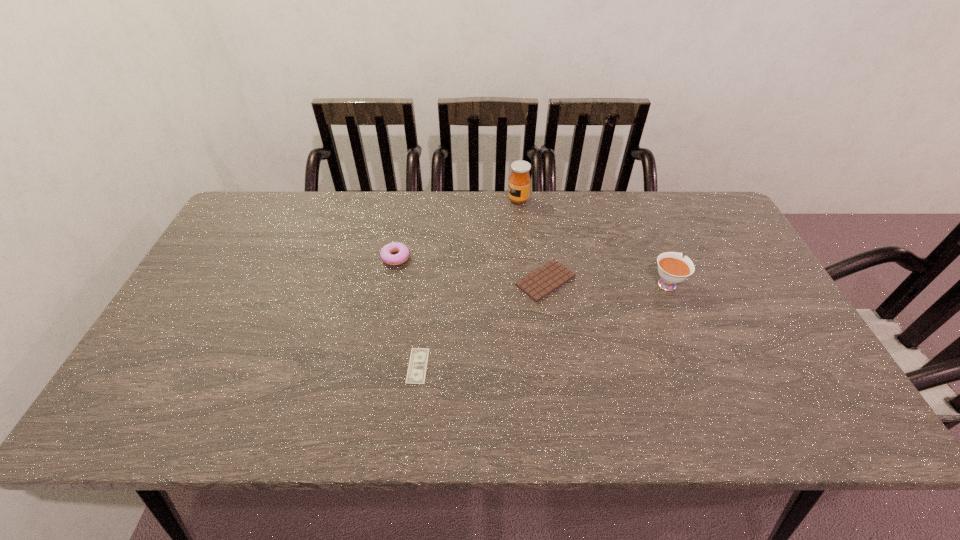
Locate an element on the screen. free space at the near edge is located at coordinates (295, 408).

The height and width of the screenshot is (540, 960). I want to click on free space at the left edge of the desktop, so click(202, 363).

Identify the location of vacant space at the right edge of the desktop. The height and width of the screenshot is (540, 960). (720, 245).

The height and width of the screenshot is (540, 960). What are the coordinates of `vacant space at the far left corner of the desktop` in the screenshot? It's located at (276, 221).

At what (x,y) coordinates should I click in order to perform the action: click on blank space at the near left corner of the desktop. Please return your answer as a coordinate pair (x, y). Looking at the image, I should click on (185, 422).

In the image, there is a desktop. In order to click on free space at the far right corner in this screenshot , I will do `click(696, 199)`.

Locate an element on the screen. free space between the leftmost object and the second shortest object is located at coordinates (470, 269).

Where is `free area in between the rightmost object and the tallest object`? Image resolution: width=960 pixels, height=540 pixels. free area in between the rightmost object and the tallest object is located at coordinates (592, 241).

The width and height of the screenshot is (960, 540). Identify the location of free space that is in between the chocolate bar and the money. (482, 323).

I want to click on free space between the shortest object and the farthest object, so click(x=468, y=282).